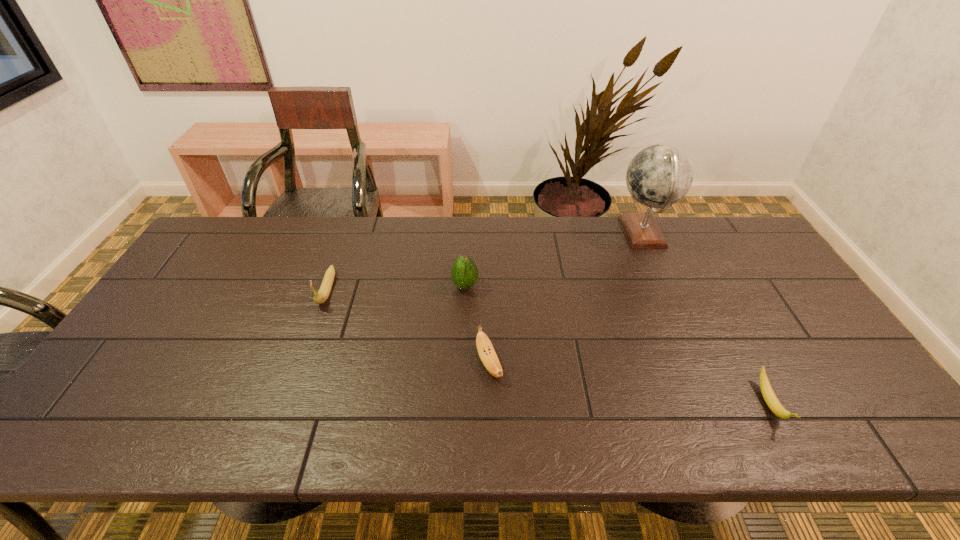
Identify the location of vacant position located on the front of the avocado. (462, 391).

What are the coordinates of `vacant region located at the stem of the leftmost object` in the screenshot? It's located at (289, 397).

This screenshot has height=540, width=960. Identify the location of free spot located 0.400m on the right of the second banana from left to right. (660, 364).

The height and width of the screenshot is (540, 960). Find the location of `object at the far edge`. object at the far edge is located at coordinates (660, 175).

Where is `object located at the near edge`? This screenshot has width=960, height=540. object located at the near edge is located at coordinates (768, 394).

The image size is (960, 540). In order to click on free region at the far edge of the desktop in this screenshot , I will do `click(513, 258)`.

The width and height of the screenshot is (960, 540). Identify the location of vacant region at the near edge of the desktop. (344, 439).

Find the location of a particular element. This screenshot has height=540, width=960. vacant space at the left edge is located at coordinates (87, 409).

You are a GUI agent. You are given a task and a screenshot of the screen. Output one action in this format:
    pyautogui.click(x=<x>, y=<y>)
    Task: Click on the vacant space at the right edge of the desktop
    
    Given the screenshot: What is the action you would take?
    pyautogui.click(x=852, y=386)

Where is `free point at the near left corner`? The image size is (960, 540). free point at the near left corner is located at coordinates (93, 431).